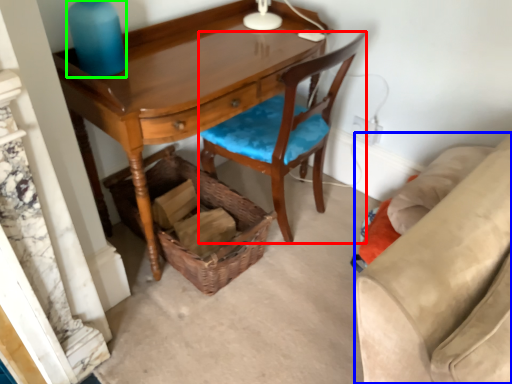
Question: Considering the real-world distances, which object is closest to chair (highlighted by a red box)? studio couch (highlighted by a blue box) or bottle (highlighted by a green box).

Choices:
 (A) studio couch
 (B) bottle

Answer: (B)